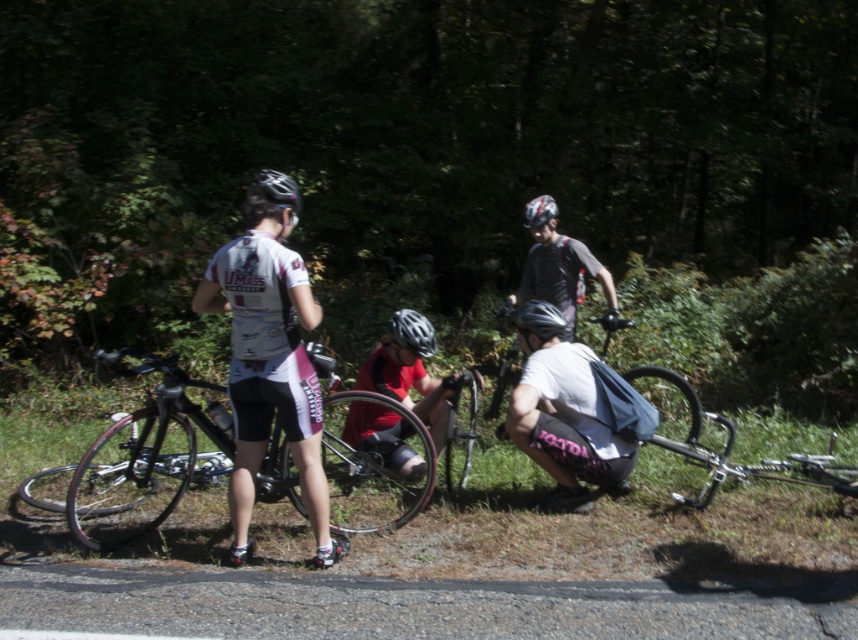
Which is more to the right, white matte helmet at center or white matte bicycle helmet at center?

Positioned to the right is white matte helmet at center.

Is white matte helmet at center further to camera compared to white matte bicycle helmet at center?

No, white matte helmet at center is in front of white matte bicycle helmet at center.

You are a GUI agent. You are given a task and a screenshot of the screen. Output one action in this format:
    pyautogui.click(x=<x>, y=<y>)
    Task: Click on the white matte helmet at center
    The width and height of the screenshot is (858, 640).
    Given the screenshot: What is the action you would take?
    pyautogui.click(x=565, y=413)

Find the location of a particular element. The image size is (858, 640). white matte helmet at center is located at coordinates (565, 413).

The height and width of the screenshot is (640, 858). Find the location of `white matte bicycle helmet at center`. white matte bicycle helmet at center is located at coordinates (412, 332).

Is white matte bicycle helmet at center thinner than matte black helmet at upper center?

No, white matte bicycle helmet at center is not thinner than matte black helmet at upper center.

Is point (409, 326) closer to viewer compared to point (273, 180)?

No, it is not.

Find the location of a particular element. The height and width of the screenshot is (640, 858). white matte bicycle helmet at center is located at coordinates (412, 332).

Does matte black helmet at center have a lesser width compared to matte black helmet at upper center?

Incorrect, matte black helmet at center's width is not less than matte black helmet at upper center's.

Does matte black helmet at center have a smaller size compared to matte black helmet at upper center?

No.

Who is more forward, (523, 314) or (281, 172)?

Point (523, 314)

The width and height of the screenshot is (858, 640). Identify the location of matte black helmet at center. (x=539, y=317).